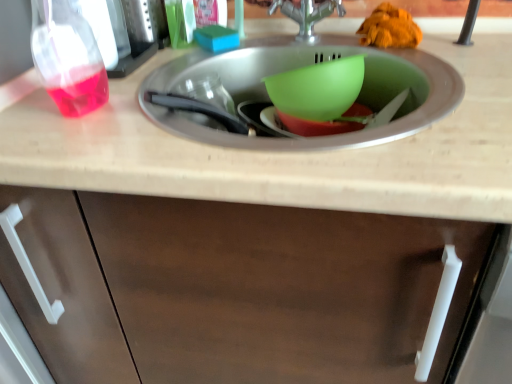
Question: Could you tell me if silver metallic tap at center is turned towards blue sponge at upper center, the 1th food positioned from the left?

Choices:
 (A) yes
 (B) no

Answer: (B)

Question: From a real-world perspective, is silver metallic tap at center on blue sponge at upper center, which appears as the second food when viewed from the right?

Choices:
 (A) yes
 (B) no

Answer: (A)

Question: Does silver metallic tap at center appear on the right side of blue sponge at upper center, which appears as the second food when viewed from the right?

Choices:
 (A) no
 (B) yes

Answer: (B)

Question: Can you confirm if silver metallic tap at center is bigger than blue sponge at upper center, the 1th food positioned from the left?

Choices:
 (A) yes
 (B) no

Answer: (A)

Question: Considering the relative sizes of silver metallic tap at center and blue sponge at upper center, which appears as the second food when viewed from the right, in the image provided, is silver metallic tap at center taller than blue sponge at upper center, which appears as the second food when viewed from the right,?

Choices:
 (A) no
 (B) yes

Answer: (B)

Question: From their relative heights in the image, would you say silver metallic tap at center is taller or shorter than green plastic bowl at center, which ranks as the second basin in top-to-bottom order?

Choices:
 (A) short
 (B) tall

Answer: (B)

Question: Looking at the image, does silver metallic tap at center seem bigger or smaller compared to green plastic bowl at center, which ranks as the second basin in top-to-bottom order?

Choices:
 (A) small
 (B) big

Answer: (B)

Question: Is point (276, 1) positioned closer to the camera than point (306, 120)?

Choices:
 (A) closer
 (B) farther

Answer: (B)

Question: Considering their positions, is silver metallic tap at center located in front of or behind green plastic bowl at center, which ranks as the second basin in top-to-bottom order?

Choices:
 (A) behind
 (B) front

Answer: (B)

Question: Is transparent plastic bottle at left inside the boundaries of green plastic bowl at center, which is counted as the 1th basin, starting from the bottom, or outside?

Choices:
 (A) inside
 (B) outside

Answer: (B)

Question: Based on their sizes in the image, would you say transparent plastic bottle at left is bigger or smaller than green plastic bowl at center, which ranks as the second basin in top-to-bottom order?

Choices:
 (A) big
 (B) small

Answer: (A)

Question: From a real-world perspective, relative to green plastic bowl at center, which ranks as the second basin in top-to-bottom order, is transparent plastic bottle at left vertically above or below?

Choices:
 (A) below
 (B) above

Answer: (B)

Question: In terms of height, does transparent plastic bottle at left look taller or shorter compared to green plastic bowl at center, which ranks as the second basin in top-to-bottom order?

Choices:
 (A) short
 (B) tall

Answer: (B)

Question: Based on their sizes in the image, would you say silver metallic tap at center is bigger or smaller than blue sponge at upper center, which appears as the second food when viewed from the right?

Choices:
 (A) big
 (B) small

Answer: (A)

Question: From the image's perspective, is silver metallic tap at center located above or below blue sponge at upper center, the 1th food positioned from the left?

Choices:
 (A) below
 (B) above

Answer: (B)